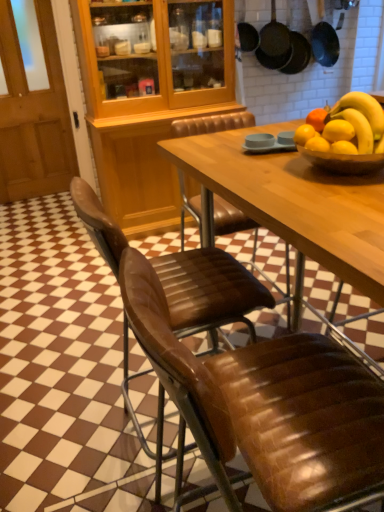
Question: From a real-world perspective, is black matte frying pan at upper right, arranged as the first frying pan when viewed from the left, physically above black matte frying pan at upper right, which is counted as the third frying pan, starting from the left?

Choices:
 (A) no
 (B) yes

Answer: (B)

Question: Can you confirm if black matte frying pan at upper right, arranged as the first frying pan when viewed from the left, is thinner than black matte frying pan at upper right, acting as the 1th frying pan starting from the right?

Choices:
 (A) yes
 (B) no

Answer: (A)

Question: Considering the relative sizes of black matte frying pan at upper right, arranged as the first frying pan when viewed from the left, and black matte frying pan at upper right, acting as the 1th frying pan starting from the right, in the image provided, is black matte frying pan at upper right, arranged as the first frying pan when viewed from the left, bigger than black matte frying pan at upper right, acting as the 1th frying pan starting from the right,?

Choices:
 (A) no
 (B) yes

Answer: (A)

Question: From a real-world perspective, is black matte frying pan at upper right, the third frying pan when ordered from right to left, physically below black matte frying pan at upper right, acting as the 1th frying pan starting from the right?

Choices:
 (A) yes
 (B) no

Answer: (B)

Question: Is black matte frying pan at upper right, the third frying pan when ordered from right to left, smaller than black matte frying pan at upper right, which is counted as the third frying pan, starting from the left?

Choices:
 (A) yes
 (B) no

Answer: (A)

Question: From their relative heights in the image, would you say black matte frying pan at upper center, acting as the 2th frying pan starting from the left, is taller or shorter than black matte frying pan at upper right, arranged as the first frying pan when viewed from the left?

Choices:
 (A) short
 (B) tall

Answer: (B)

Question: Based on their sizes in the image, would you say black matte frying pan at upper center, the second frying pan positioned from the right, is bigger or smaller than black matte frying pan at upper right, arranged as the first frying pan when viewed from the left?

Choices:
 (A) small
 (B) big

Answer: (B)

Question: Is black matte frying pan at upper center, the second frying pan positioned from the right, wider or thinner than black matte frying pan at upper right, the third frying pan when ordered from right to left?

Choices:
 (A) wide
 (B) thin

Answer: (A)

Question: From a real-world perspective, relative to black matte frying pan at upper right, the third frying pan when ordered from right to left, is black matte frying pan at upper center, acting as the 2th frying pan starting from the left, vertically above or below?

Choices:
 (A) below
 (B) above

Answer: (A)

Question: Would you say black matte frying pan at upper center, acting as the 2th frying pan starting from the left, is inside or outside wooden door at left?

Choices:
 (A) outside
 (B) inside

Answer: (A)

Question: Based on their sizes in the image, would you say black matte frying pan at upper center, acting as the 2th frying pan starting from the left, is bigger or smaller than wooden door at left?

Choices:
 (A) small
 (B) big

Answer: (A)

Question: Considering the relative positions of black matte frying pan at upper center, acting as the 2th frying pan starting from the left, and wooden door at left in the image provided, is black matte frying pan at upper center, acting as the 2th frying pan starting from the left, to the left or to the right of wooden door at left?

Choices:
 (A) left
 (B) right

Answer: (B)

Question: From the image's perspective, relative to wooden door at left, is black matte frying pan at upper center, the second frying pan positioned from the right, above or below?

Choices:
 (A) above
 (B) below

Answer: (A)

Question: Considering the relative positions of brown leather chair at center, positioned as the 1th chair in front-to-back order, and wooden door at left in the image provided, is brown leather chair at center, positioned as the 1th chair in front-to-back order, to the left or to the right of wooden door at left?

Choices:
 (A) right
 (B) left

Answer: (A)

Question: Would you say brown leather chair at center, the second chair viewed from the back, is inside or outside wooden door at left?

Choices:
 (A) outside
 (B) inside

Answer: (A)